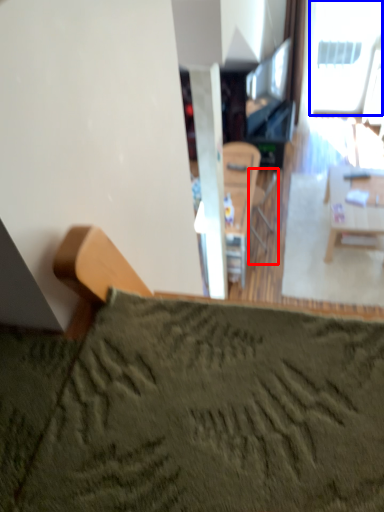
Question: Which object is closer to the camera taking this photo, armchair (highlighted by a red box) or window (highlighted by a blue box)?

Choices:
 (A) armchair
 (B) window

Answer: (A)